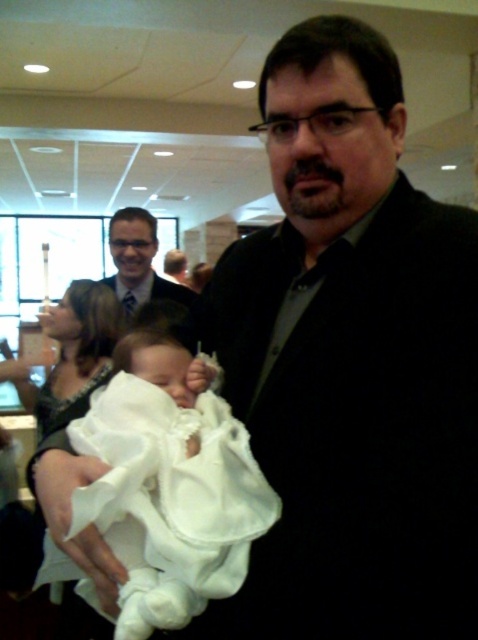
Which is below, white satin baby at center or matte black suit at center?

white satin baby at center

The image size is (478, 640). I want to click on white satin baby at center, so click(169, 486).